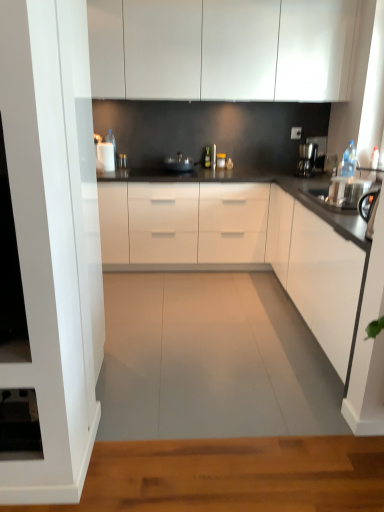
Question: From the image's perspective, is white glossy cabinets at upper center, placed as the 2th cabinetry when sorted from bottom to top, located beneath sleek black coffee machine at right?

Choices:
 (A) yes
 (B) no

Answer: (B)

Question: Is white glossy cabinets at upper center, the first cabinetry in the top-to-bottom sequence, closer to camera compared to sleek black coffee machine at right?

Choices:
 (A) no
 (B) yes

Answer: (B)

Question: Does white glossy cabinets at upper center, placed as the 2th cabinetry when sorted from bottom to top, appear on the left side of sleek black coffee machine at right?

Choices:
 (A) no
 (B) yes

Answer: (B)

Question: Is sleek black coffee machine at right at the back of white glossy cabinets at upper center, placed as the 2th cabinetry when sorted from bottom to top?

Choices:
 (A) no
 (B) yes

Answer: (A)

Question: Considering the relative sizes of white glossy cabinets at upper center, the first cabinetry in the top-to-bottom sequence, and sleek black coffee machine at right in the image provided, is white glossy cabinets at upper center, the first cabinetry in the top-to-bottom sequence, wider than sleek black coffee machine at right?

Choices:
 (A) yes
 (B) no

Answer: (A)

Question: From the image's perspective, is white glossy cabinets at upper center, the first cabinetry in the top-to-bottom sequence, located above sleek black coffee machine at right?

Choices:
 (A) no
 (B) yes

Answer: (B)

Question: Is white glossy cabinet at right, which ranks as the second cabinetry in top-to-bottom order, oriented away from metallic silver pan at center?

Choices:
 (A) no
 (B) yes

Answer: (A)

Question: Does white glossy cabinet at right, which ranks as the second cabinetry in top-to-bottom order, come in front of metallic silver pan at center?

Choices:
 (A) no
 (B) yes

Answer: (B)

Question: Is white glossy cabinet at right, which ranks as the second cabinetry in top-to-bottom order, positioned far away from metallic silver pan at center?

Choices:
 (A) no
 (B) yes

Answer: (B)

Question: From a real-world perspective, is white glossy cabinet at right, which ranks as the second cabinetry in top-to-bottom order, positioned over metallic silver pan at center based on gravity?

Choices:
 (A) no
 (B) yes

Answer: (A)

Question: Is the position of white glossy cabinet at right, the 1th cabinetry ordered from the bottom, more distant than that of metallic silver pan at center?

Choices:
 (A) no
 (B) yes

Answer: (A)

Question: Could metallic silver pan at center be considered to be inside white glossy cabinet at right, which ranks as the second cabinetry in top-to-bottom order?

Choices:
 (A) yes
 (B) no

Answer: (B)

Question: From the image's perspective, is sleek black coffee machine at right under metallic silver pan at center?

Choices:
 (A) yes
 (B) no

Answer: (A)